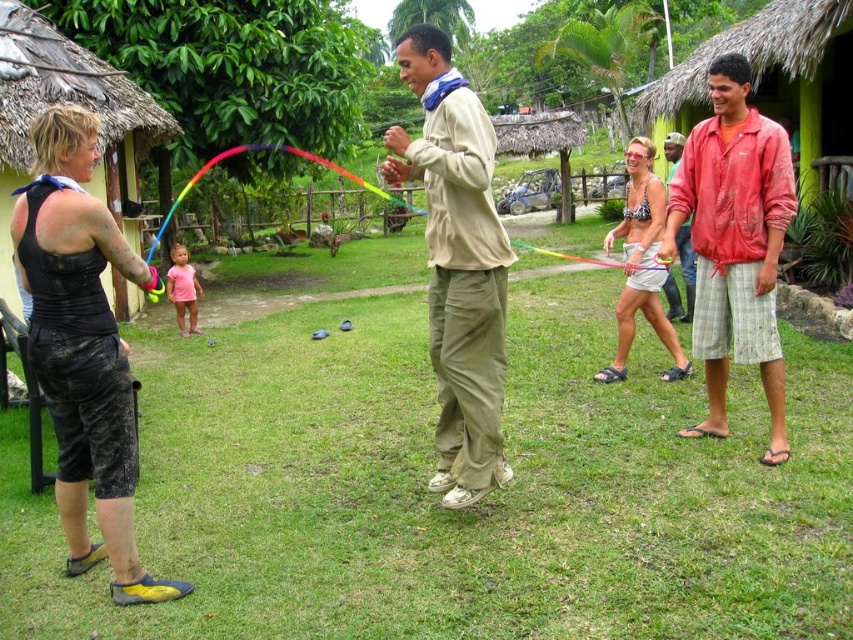
Question: Which object is farther from the camera taking this photo?

Choices:
 (A) printed bikini top at center
 (B) red cotton shirt at right
 (C) black matte shorts at left

Answer: (A)

Question: Which of the following is the farthest from the observer?

Choices:
 (A) rainbow plastic kite at center
 (B) red cotton shirt at right
 (C) black matte shorts at left

Answer: (B)

Question: Considering the relative positions of beige fabric pants at center and red fabric shirt at right in the image provided, where is beige fabric pants at center located with respect to red fabric shirt at right?

Choices:
 (A) below
 (B) above

Answer: (B)

Question: Is black matte shorts at left below red cotton shirt at right?

Choices:
 (A) no
 (B) yes

Answer: (B)

Question: Which object is closer to the camera taking this photo?

Choices:
 (A) black matte shorts at left
 (B) beige fabric pants at center
 (C) rainbow plastic kite at center
 (D) red cotton shirt at right

Answer: (A)

Question: Is black matte shorts at left below rainbow plastic kite at center?

Choices:
 (A) no
 (B) yes

Answer: (B)